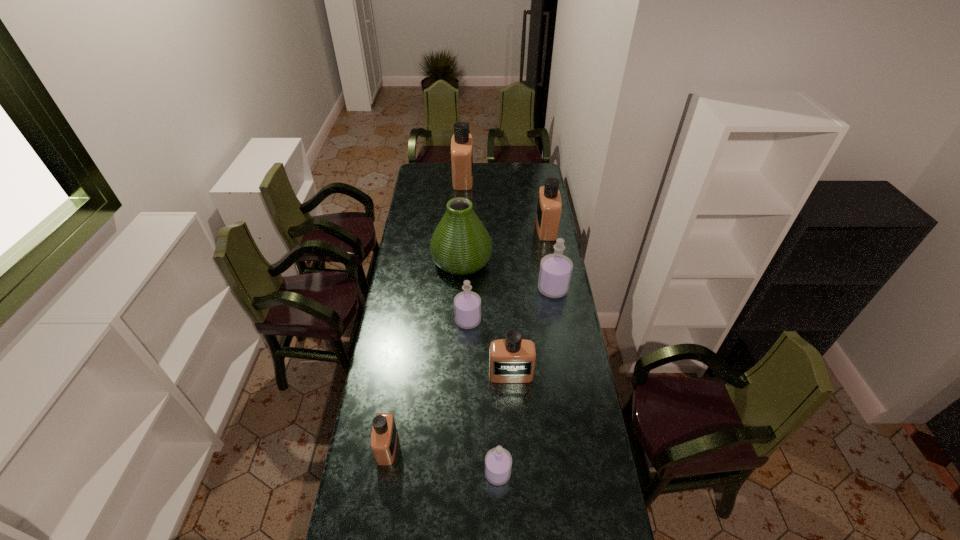
The height and width of the screenshot is (540, 960). Find the location of `vacant space at the far left corner`. vacant space at the far left corner is located at coordinates (414, 180).

This screenshot has height=540, width=960. In order to click on empty location between the nearest purple perfume and the second smallest beige perfume in this screenshot , I will do `click(504, 423)`.

This screenshot has width=960, height=540. I want to click on free space between the rightmost purple perfume and the second smallest beige perfume, so click(x=532, y=332).

Locate an element on the screen. This screenshot has height=540, width=960. empty space that is in between the fifth farthest perfume and the leftmost perfume is located at coordinates (449, 410).

This screenshot has width=960, height=540. What are the coordinates of `vacant point located between the biggest purple perfume and the vase` in the screenshot? It's located at (507, 275).

Select which object is the second closest to the second beige perfume from left to right. Please provide its 2D coordinates. Your answer should be formatted as a tuple, i.e. [(x, y)], where the tuple contains the x and y coordinates of a point satisfying the conditions above.

[(460, 245)]

Select which object is the seventh closest to the smallest purple perfume. Please provide its 2D coordinates. Your answer should be formatted as a tuple, i.e. [(x, y)], where the tuple contains the x and y coordinates of a point satisfying the conditions above.

[(462, 142)]

Locate which perfume is the fourth closest to the rightmost beige perfume. Please provide its 2D coordinates. Your answer should be formatted as a tuple, i.e. [(x, y)], where the tuple contains the x and y coordinates of a point satisfying the conditions above.

[(512, 360)]

Where is `perfume that stands as the fourth closest to the fifth farthest perfume`? The height and width of the screenshot is (540, 960). perfume that stands as the fourth closest to the fifth farthest perfume is located at coordinates (384, 435).

The image size is (960, 540). In order to click on beige perfume that is the second nearest to the second nearest beige perfume in this screenshot , I will do `click(549, 206)`.